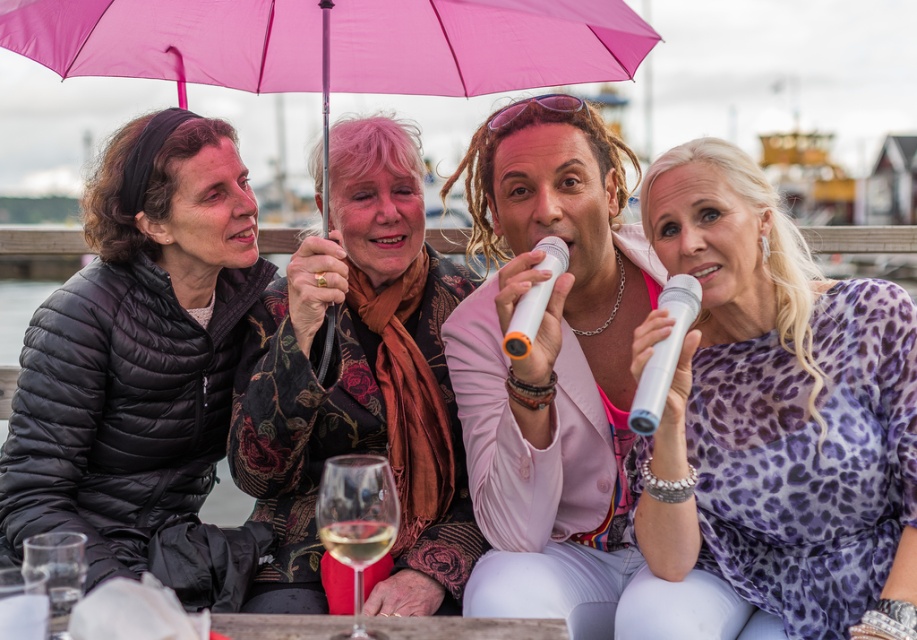
Is black quilted jacket at left thinner than translucent glass at lower center?

In fact, black quilted jacket at left might be wider than translucent glass at lower center.

Between black quilted jacket at left and translucent glass at lower center, which one has more height?

black quilted jacket at left is taller.

The image size is (917, 640). In order to click on black quilted jacket at left in this screenshot , I will do `click(142, 368)`.

Who is positioned more to the right, purple leopard print dress at center or leopard print dress at center?

purple leopard print dress at center is more to the right.

Is point (823, 605) positioned in front of point (643, 278)?

Yes.

Identify the location of purple leopard print dress at center. (780, 412).

Identify the location of black quilted jacket at left. (142, 368).

Does black quilted jacket at left appear under pink fabric umbrella at upper center?

Correct, black quilted jacket at left is located below pink fabric umbrella at upper center.

Which is behind, point (199, 472) or point (525, 33)?

The point (199, 472) is more distant.

You are a GUI agent. You are given a task and a screenshot of the screen. Output one action in this format:
    pyautogui.click(x=<x>, y=<y>)
    Task: Click on the black quilted jacket at left
    The image size is (917, 640).
    Given the screenshot: What is the action you would take?
    click(142, 368)